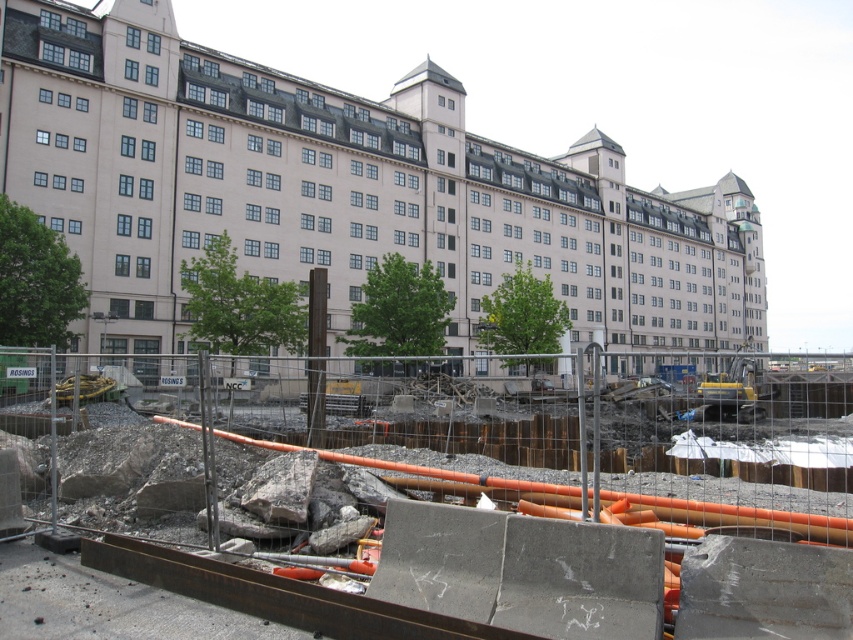
Question: Is the position of rusty metal pipes at center less distant than that of light beige concrete building at center?

Choices:
 (A) no
 (B) yes

Answer: (B)

Question: Which object appears closest to the camera in this image?

Choices:
 (A) rusty metal pipes at center
 (B) light beige concrete building at center

Answer: (A)

Question: Considering the relative positions of rusty metal pipes at center and light beige concrete building at center in the image provided, where is rusty metal pipes at center located with respect to light beige concrete building at center?

Choices:
 (A) below
 (B) above

Answer: (A)

Question: Is rusty metal pipes at center smaller than light beige concrete building at center?

Choices:
 (A) no
 (B) yes

Answer: (B)

Question: Which point is farther to the camera?

Choices:
 (A) light beige concrete building at center
 (B) rusty metal pipes at center

Answer: (A)

Question: Which object is farther from the camera taking this photo?

Choices:
 (A) light beige concrete building at center
 (B) rusty metal pipes at center

Answer: (A)